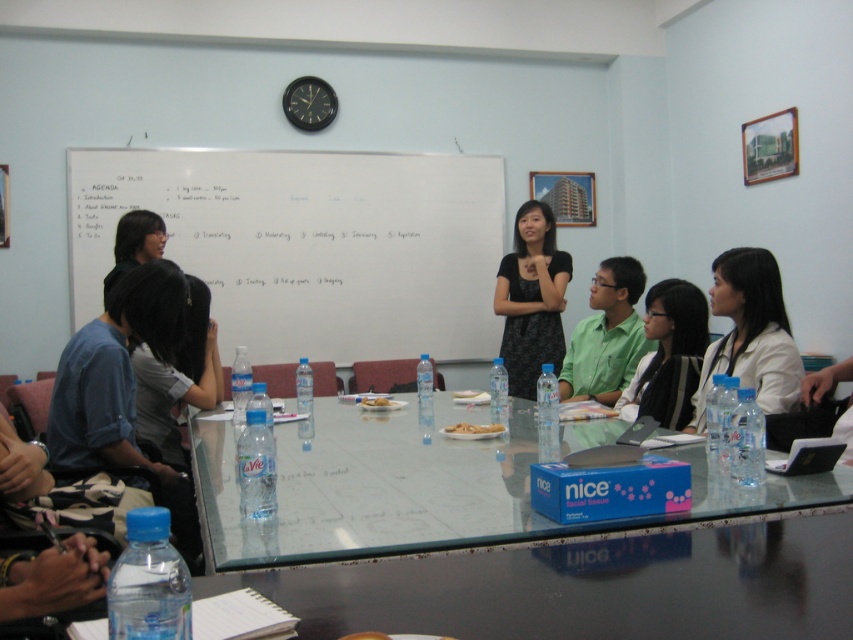
At what (x,y) coordinates should I click in order to perform the action: click on whiteboard at upper center. Please return your answer as a coordinate pair (x, y). Looking at the image, I should click on (309, 244).

Is point (335, 358) positioned after point (160, 451)?

Yes, it is behind point (160, 451).

Does point (492, 212) come farther from viewer compared to point (146, 452)?

Yes, it is.

Find the location of `whiteboard at upper center`. whiteboard at upper center is located at coordinates (309, 244).

Looking at this image, can you confirm if black matte dress at center is thinner than green matte shirt at center?

Incorrect, black matte dress at center's width is not less than green matte shirt at center's.

Is point (544, 353) in front of point (602, 292)?

No, (544, 353) is further to viewer.

This screenshot has width=853, height=640. I want to click on black matte dress at center, so click(x=531, y=298).

Does point (618, 349) come closer to viewer compared to point (200, 387)?

No, (618, 349) is behind (200, 387).

Based on the photo, is green matte shirt at center shorter than matte gray shirt at lower left?

Correct, green matte shirt at center is not as tall as matte gray shirt at lower left.

Is point (608, 308) more distant than point (160, 417)?

That is True.

At what (x,y) coordinates should I click in order to perform the action: click on green matte shirt at center. Please return your answer as a coordinate pair (x, y). The height and width of the screenshot is (640, 853). Looking at the image, I should click on (606, 336).